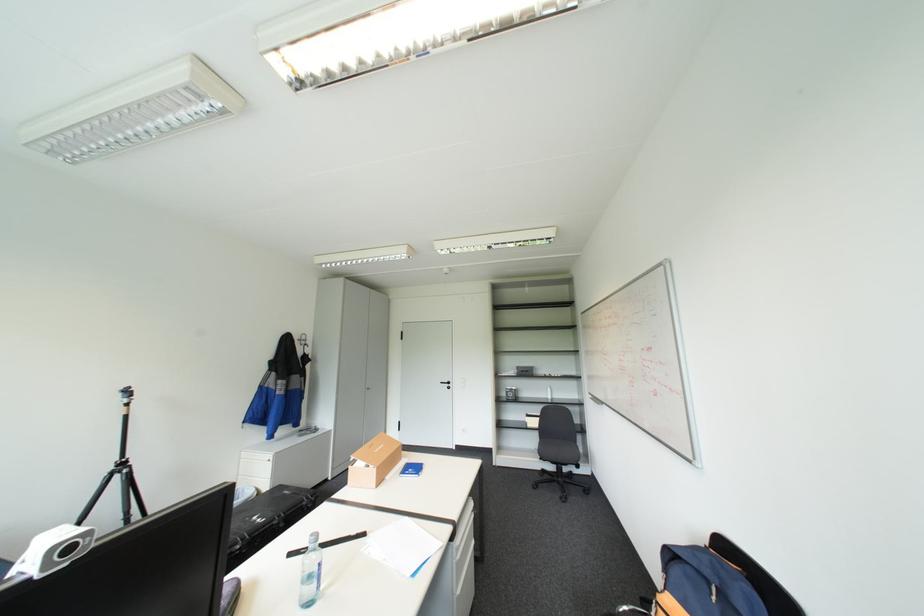
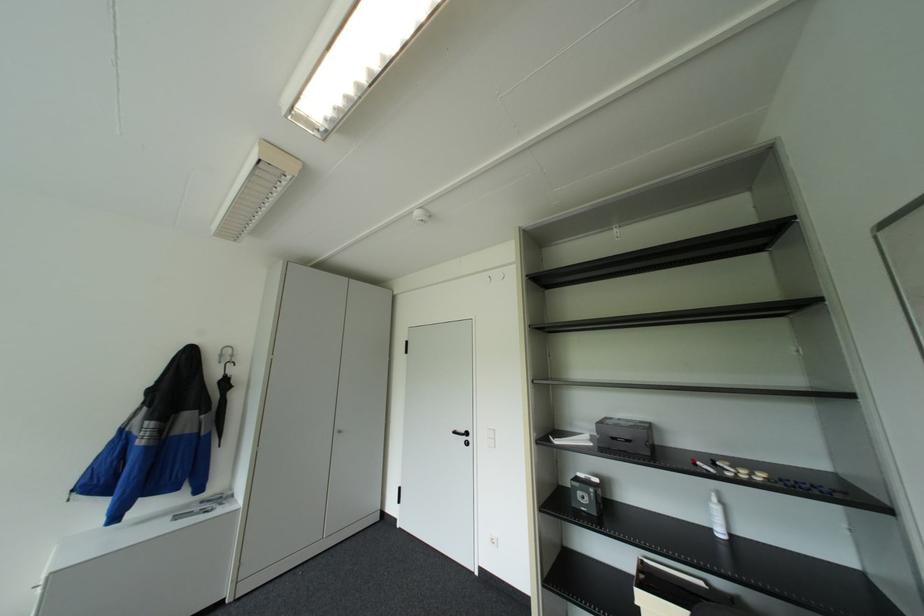
In the second image, find the point that corresponds to point (310, 342) in the first image.

(227, 361)